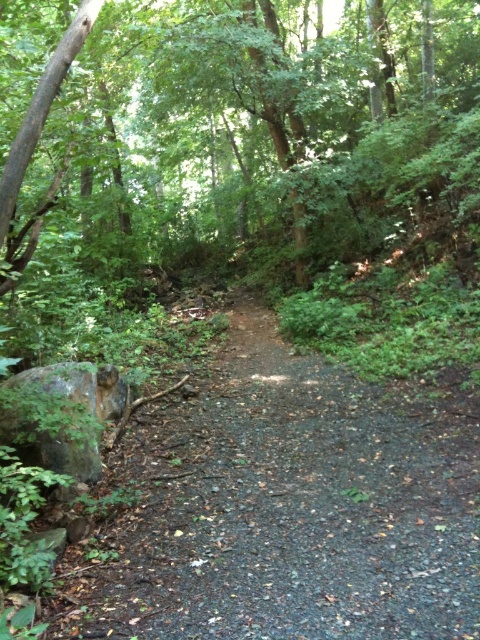
Consider the image. You are a hiker with a 1.2 meter wide tent. You want to set up your tent on the dirt path at center or the rusty metallic rock at left. Which location has enough space to accommodate your tent without overlapping onto other areas?

The dirt path at center has a larger width than the rusty metallic rock at left, so the dirt path at center can accommodate the 1.2 meter wide tent without overlapping onto other areas.

You are a hiker carrying a backpack and need to step from the dirt path at center to the rusty metallic rock at left. Can you reach the rock without moving more than 30 inches from the path?

The dirt path at center is 30.85 inches away from the rusty metallic rock at left. Since 30.85 inches is slightly more than 30 inches, you cannot reach the rock without moving more than 30 inches from the path.